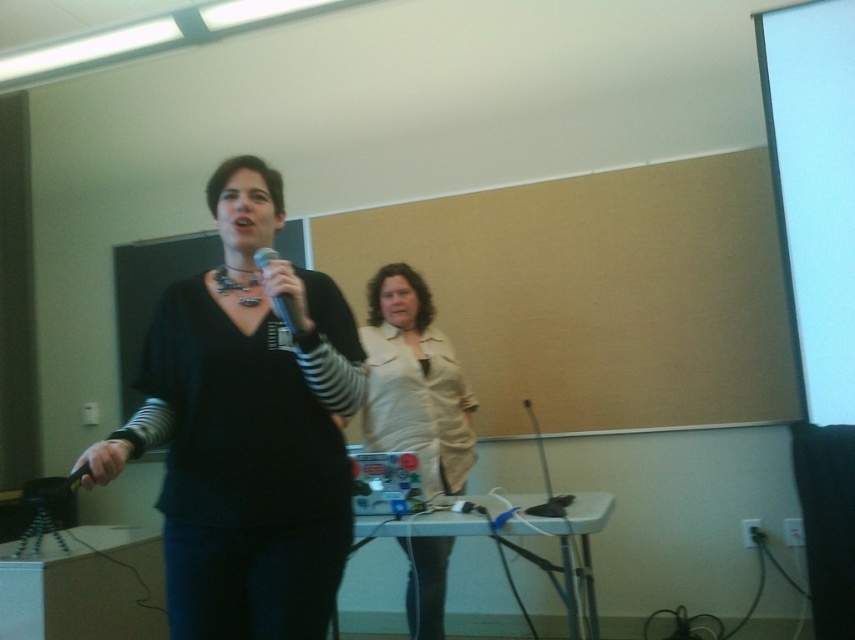
Question: Can you confirm if white matte projection screen at upper right is bigger than beige fabric coat at center?

Choices:
 (A) yes
 (B) no

Answer: (B)

Question: Which of the following is the closest to the observer?

Choices:
 (A) matte black sweater at center
 (B) white matte projection screen at upper right
 (C) beige fabric coat at center
 (D) matte black microphone at center

Answer: (A)

Question: Among these points, which one is nearest to the camera?

Choices:
 (A) (794, 163)
 (B) (287, 328)
 (C) (252, 250)

Answer: (B)

Question: Can you confirm if white matte projection screen at upper right is positioned above beige fabric coat at center?

Choices:
 (A) no
 (B) yes

Answer: (B)

Question: Is white matte projection screen at upper right below beige fabric coat at center?

Choices:
 (A) yes
 (B) no

Answer: (B)

Question: Which point is farther from the camera taking this photo?

Choices:
 (A) (789, 122)
 (B) (211, 292)

Answer: (A)